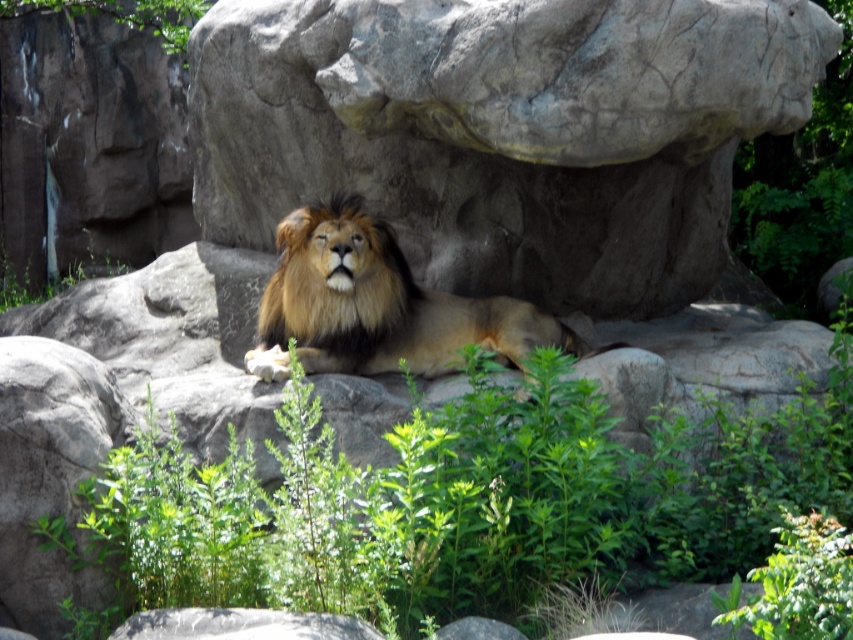
You are a zookeeper standing at the camera position. You need to place a new feeding tray for the lion. The tray requires a flat surface that is at least 10 meters away from the lion to ensure safety. Can you use the gray rough rock at center as a suitable location for the feeding tray?

The gray rough rock at center is 8.27 meters away from the camera, which is your current position. Since the required distance is 10 meters, the rock is too close. Choose a different location further away.

You are a photographer standing in front of the lion enclosure. You want to take a photo of the two points mentioned in the scene. Which point is closer to your camera, point (247, 243) or point (508, 547)?

Point (508, 547) is closer to the camera because the description states that point (247, 243) is further away than point (508, 547).

You are standing at the entrance of the zoo enclosure and see a lion resting on a rocky surface. There is also a point marked at coordinates [461,502]. What object is located at that point?

The point at coordinates [461,502] corresponds to a green leafy plant at center.